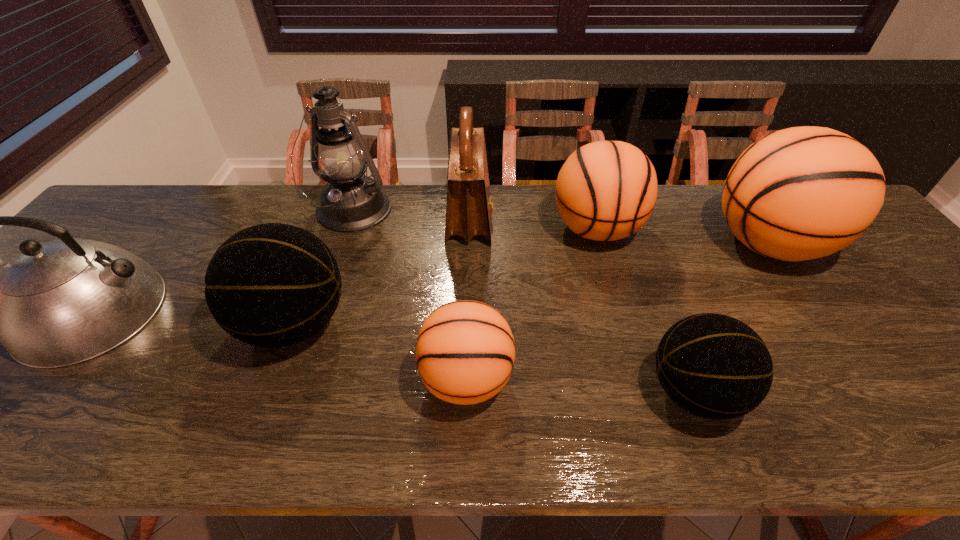
Identify the location of free space located on the front of the oil lamp. (324, 295).

The image size is (960, 540). I want to click on vacant space located on the front flap of the shoulder bag, so click(543, 220).

At what (x,y) coordinates should I click in order to perform the action: click on vacant space located 0.120m on the back of the tallest basketball. Please return your answer as a coordinate pair (x, y). This screenshot has height=540, width=960. Looking at the image, I should click on (727, 185).

What are the coordinates of `free space located 0.130m on the left of the second orange basketball from left to right` in the screenshot? It's located at (505, 230).

Where is `free space located 0.370m on the left of the left black basketball`? Image resolution: width=960 pixels, height=540 pixels. free space located 0.370m on the left of the left black basketball is located at coordinates (81, 323).

Where is `blank area located on the right of the fourth basketball from right to left`? The width and height of the screenshot is (960, 540). blank area located on the right of the fourth basketball from right to left is located at coordinates click(x=683, y=379).

You are a GUI agent. You are given a task and a screenshot of the screen. Output one action in this format:
    pyautogui.click(x=<x>, y=<y>)
    Task: Click on the free spot located 0.160m on the back of the smaller black basketball
    The image size is (960, 540).
    Given the screenshot: What is the action you would take?
    pyautogui.click(x=659, y=298)

Find the location of a particular element. Image resolution: width=960 pixels, height=540 pixels. oil lamp that is at the far edge is located at coordinates (351, 201).

In order to click on shoulder bag that is at the far edge in this screenshot , I will do `click(469, 209)`.

Locate an element on the screen. The height and width of the screenshot is (540, 960). object present at the right edge is located at coordinates (801, 193).